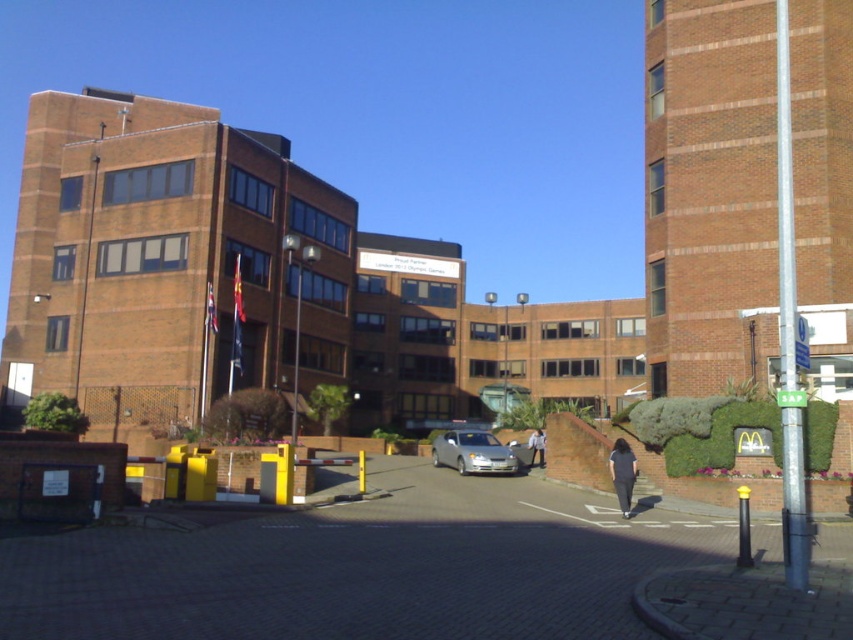
Question: Estimate the real-world distances between objects in this image. Which object is closer to the light blue denim jacket at center?

Choices:
 (A) silver metallic car at center
 (B) dark gray fabric pants at lower center

Answer: (A)

Question: Can you confirm if dark gray fabric pants at lower center is positioned below light brown leather jacket at center?

Choices:
 (A) yes
 (B) no

Answer: (B)

Question: Is silver metallic car at center closer to camera compared to light brown leather jacket at center?

Choices:
 (A) no
 (B) yes

Answer: (B)

Question: Which object is positioned farthest from the dark gray fabric pants at lower center?

Choices:
 (A) light brown leather jacket at center
 (B) light blue denim jacket at center

Answer: (B)

Question: Which object is the farthest from the light blue denim jacket at center?

Choices:
 (A) dark gray fabric pants at lower center
 (B) light brown leather jacket at center
 (C) silver metallic car at center

Answer: (A)

Question: Does silver metallic car at center have a greater width compared to dark gray fabric pants at lower center?

Choices:
 (A) no
 (B) yes

Answer: (B)